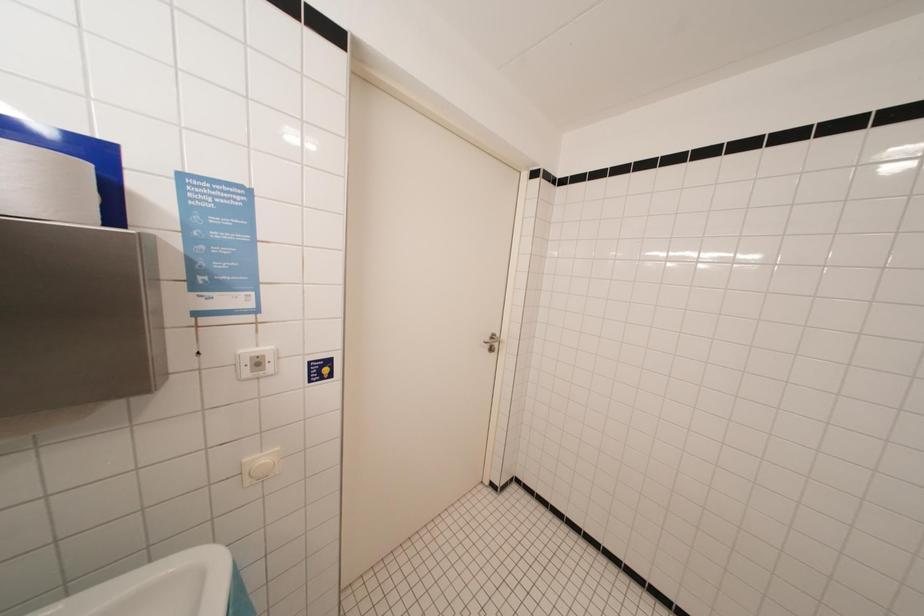
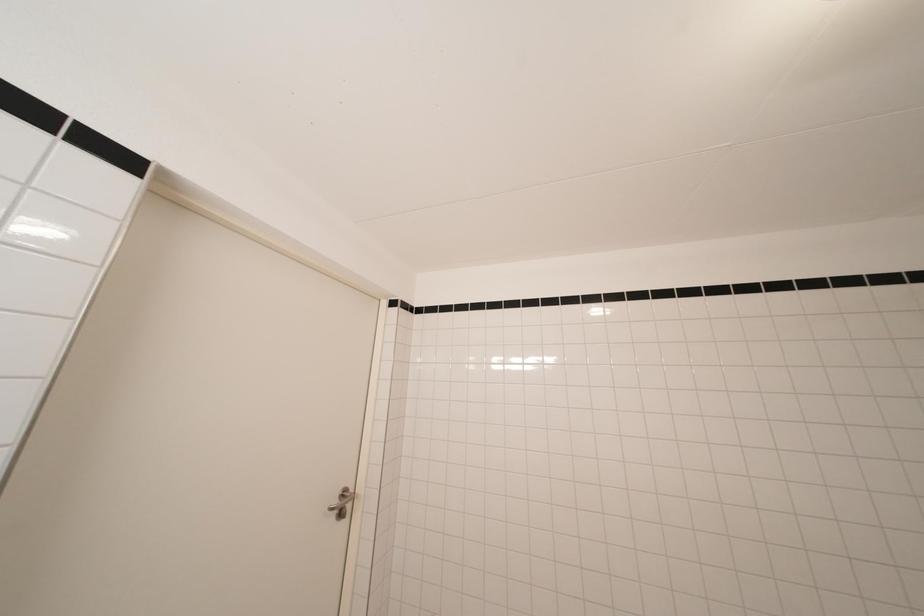
How did the camera likely rotate?

The camera rotated toward right-up.